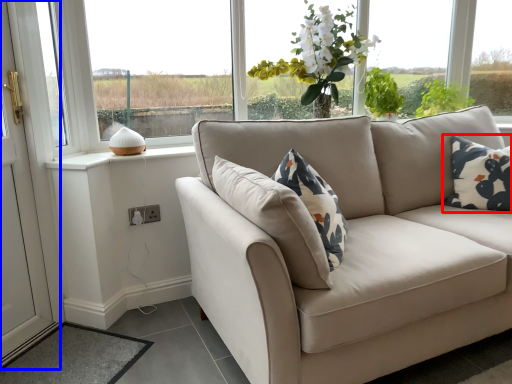
Question: Which of the following is the farthest to the observer, pillow (highlighted by a red box) or screen door (highlighted by a blue box)?

Choices:
 (A) pillow
 (B) screen door

Answer: (A)